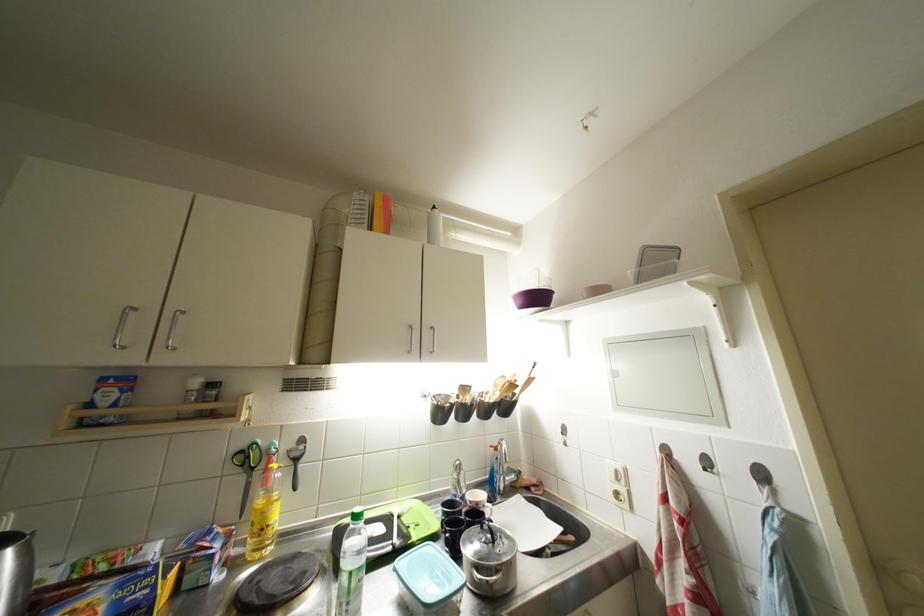
Where would you lift the white mug? Please return your answer as a coordinate pair (x, y).

(478, 500)